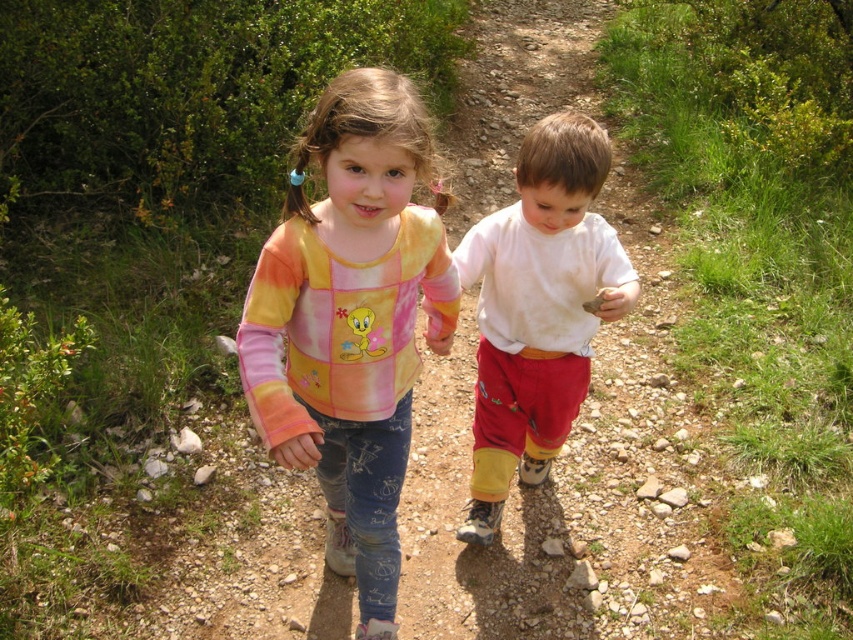
Question: Is dirt track at center to the right of white cotton shirt at center from the viewer's perspective?

Choices:
 (A) no
 (B) yes

Answer: (A)

Question: Where is dirt track at center located in relation to white cotton shirt at center in the image?

Choices:
 (A) right
 (B) left

Answer: (B)

Question: Which point is closer to the camera?

Choices:
 (A) tie-dye fabric shirt at center
 (B) white cotton shirt at center
 (C) dirt track at center

Answer: (A)

Question: Based on their relative distances, which object is farther from the dirt track at center?

Choices:
 (A) tie-dye fabric shirt at center
 (B) white cotton shirt at center

Answer: (A)

Question: Which object appears farthest from the camera in this image?

Choices:
 (A) white cotton shirt at center
 (B) dirt track at center

Answer: (B)

Question: Is dirt track at center below white cotton shirt at center?

Choices:
 (A) yes
 (B) no

Answer: (B)